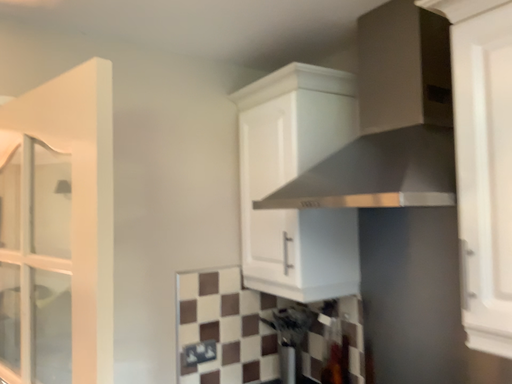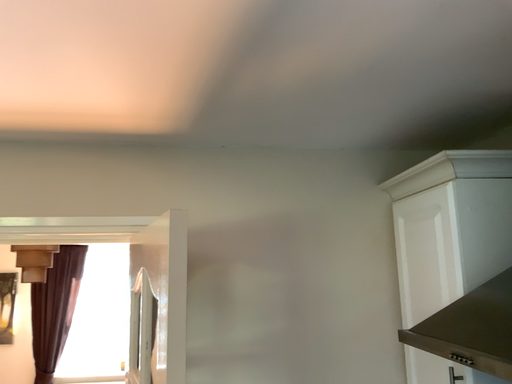
Question: Which way did the camera rotate in the video?

Choices:
 (A) rotated upward
 (B) rotated downward

Answer: (A)